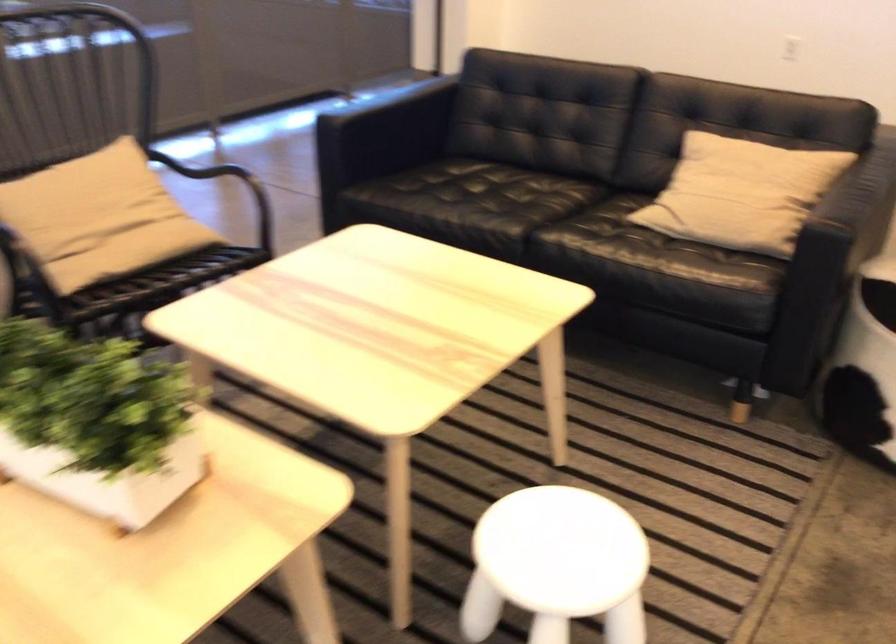
This screenshot has height=644, width=896. Identify the location of white planter. (96, 422).